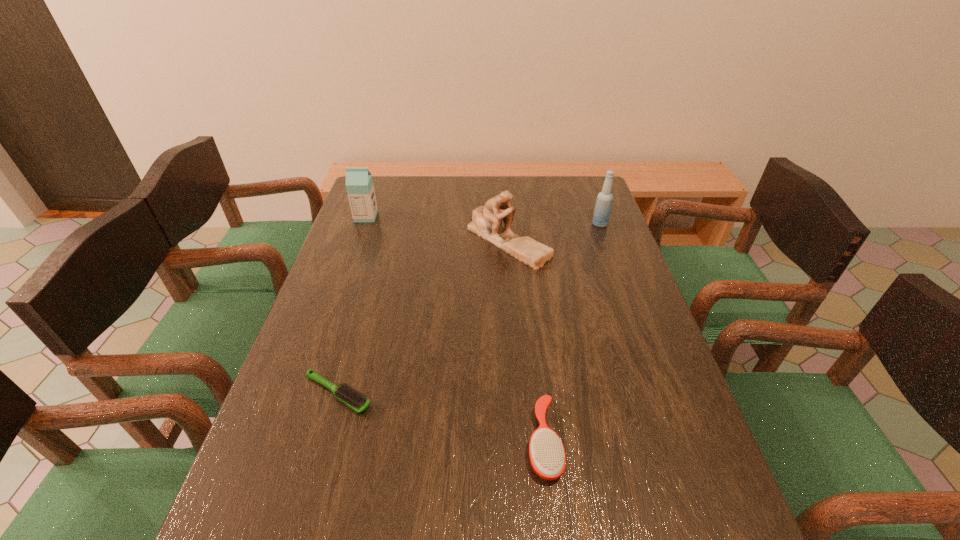
Locate an element on the screen. object that ranks as the third closest to the milk carton is located at coordinates (603, 205).

Where is `vacant area that satisfies the following two spatial constraints: 1. on the front side of the right hairbrush; 2. on the left side of the shortest object`? The height and width of the screenshot is (540, 960). vacant area that satisfies the following two spatial constraints: 1. on the front side of the right hairbrush; 2. on the left side of the shortest object is located at coordinates (324, 441).

Where is `free space that satisfies the following two spatial constraints: 1. on the front side of the right hairbrush; 2. on the left side of the milk carton`? The image size is (960, 540). free space that satisfies the following two spatial constraints: 1. on the front side of the right hairbrush; 2. on the left side of the milk carton is located at coordinates (287, 441).

At what (x,y) coordinates should I click in order to perform the action: click on free space that satisfies the following two spatial constraints: 1. on the back side of the rightmost object; 2. on the left side of the shortest object. Please return your answer as a coordinate pair (x, y). Looking at the image, I should click on pos(386,224).